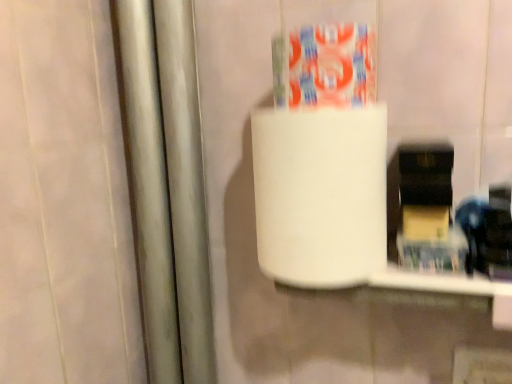
Measure the distance between white matte paper towel at center and camera.

A distance of 20.57 inches exists between white matte paper towel at center and camera.

In order to face white matte paper towel at center, should I rotate leftwards or rightwards?

Turn right approximately 8.105 degrees to face it.

Locate an element on the screen. The height and width of the screenshot is (384, 512). white matte paper towel at center is located at coordinates (321, 195).

Describe the element at coordinates (321, 195) in the screenshot. I see `white matte paper towel at center` at that location.

You are a GUI agent. You are given a task and a screenshot of the screen. Output one action in this format:
    pyautogui.click(x=<x>, y=<y>)
    Task: Click on the white matte paper towel at center
    The height and width of the screenshot is (384, 512).
    Given the screenshot: What is the action you would take?
    pyautogui.click(x=321, y=195)